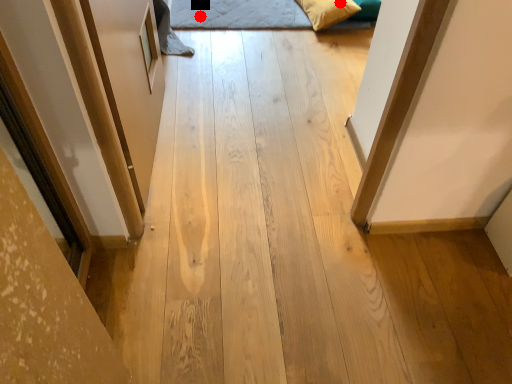
Question: Two points are circled on the image, labeled by A and B beside each circle. Which point appears farthest from the camera in this image?

Choices:
 (A) A is further
 (B) B is further

Answer: (A)